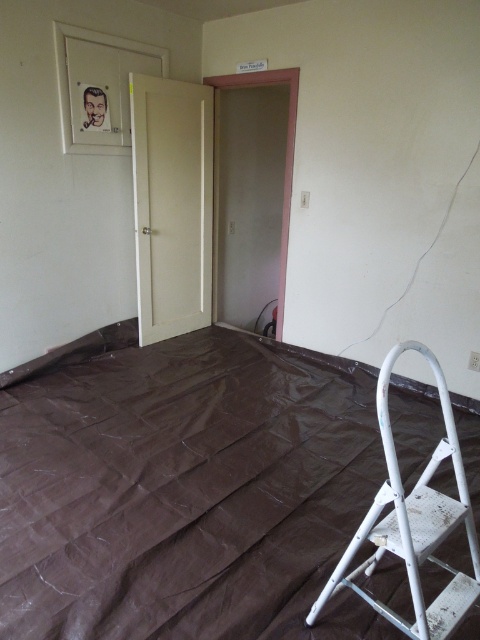
You are standing in the room and want to reach the point marked at coordinates point [104,589]. There is an obstacle at point [422,621]. Can you walk directly to your destination without going around the obstacle?

Since point [104,589] is behind point [422,621], you cannot walk directly to it without going around the obstacle at point [422,621].

You are a painter who needs to move a 1.5 meter wide painting equipment from the entrance to the wall. The entrance is near the open pink door. Can you move the equipment across the brown plastic sheet at lower right and white matte step ladder at lower right without folding it?

The brown plastic sheet at lower right is bigger than the white matte step ladder at lower right. Since the equipment is 1.5 meters wide, you need to check if there is enough space between the objects. However, the description only states the size comparison between the two objects, not the available space. Therefore, it is uncertain if the equipment can pass without folding.